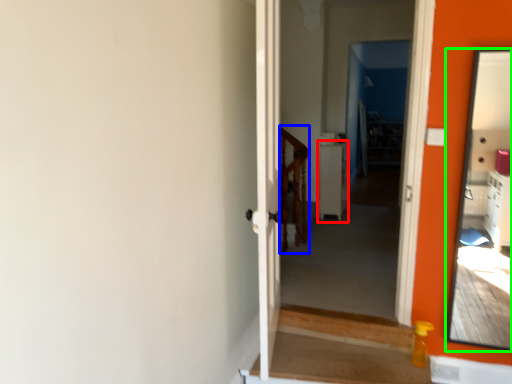
Question: Which is nearer to the table (highlighted by a red box)? balustrade (highlighted by a blue box) or mirror (highlighted by a green box).

Choices:
 (A) balustrade
 (B) mirror

Answer: (A)